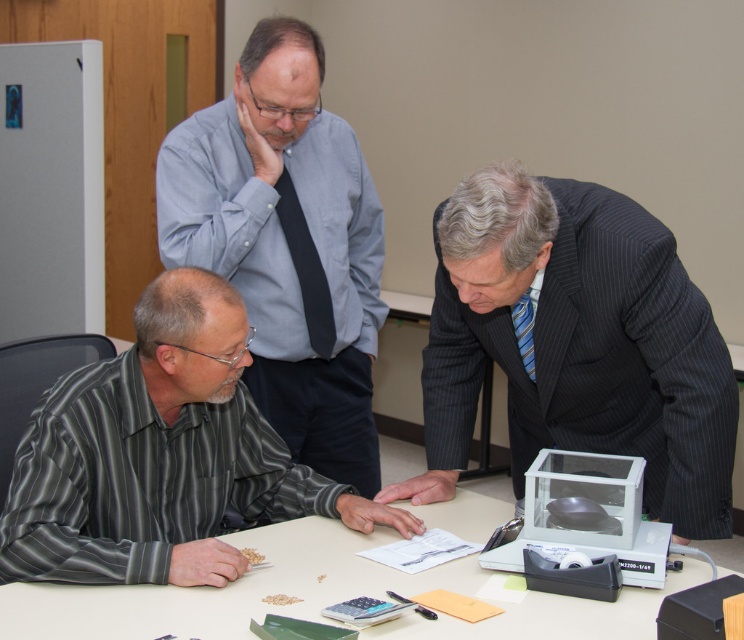
You are standing at the origin point in the room. The white plastic table at center is at coordinates 0.922, 0.312. If you want to walk directly to the table, which direction should you move in?

Since the white plastic table at center is located at coordinates (231, 589), you should move in the direction of those coordinates to reach it directly.

You are a photographer standing at the edge of the scene. You need to capture a photo that includes both the light blue shirt at upper center and the blue striped tie at right. What is the minimum distance you need to move backward to ensure both objects are in frame?

The light blue shirt at upper center is 29.23 inches from the blue striped tie at right. To capture both in frame, you need to move back at least half of that distance, so approximately 14.6 inches backward.

Please look at the image. There is a point at coordinates (286,244). Based on the scene description, can you tell me what object or part of the scene this point is located on?

The point at coordinates (286,244) is on the light blue shirt at upper center.